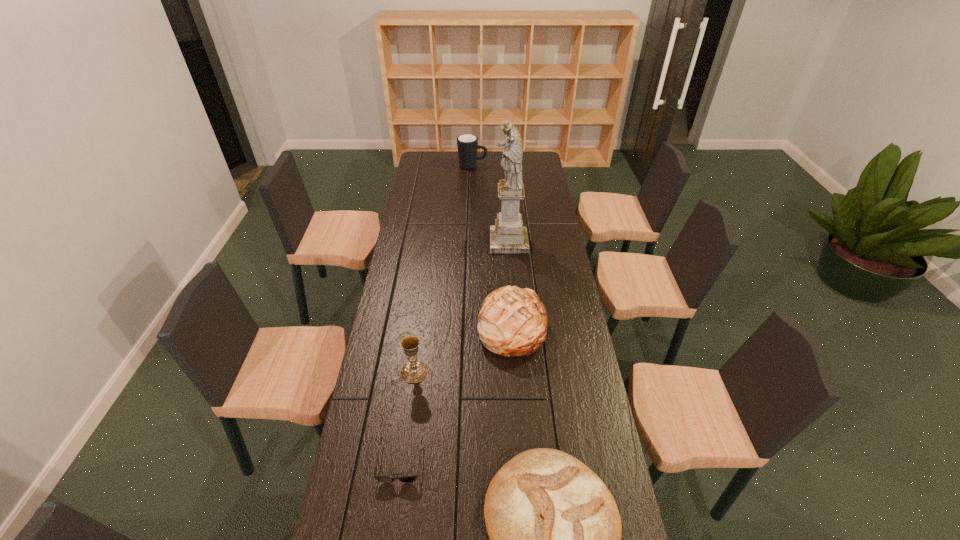
Locate an element on the screen. This screenshot has width=960, height=540. vacant space at the left edge of the desktop is located at coordinates [402, 275].

Image resolution: width=960 pixels, height=540 pixels. In order to click on vacant region at the right edge of the desktop in this screenshot , I will do `click(552, 207)`.

The image size is (960, 540). Find the location of `vacant region at the far left corner of the desktop`. vacant region at the far left corner of the desktop is located at coordinates (437, 161).

At what (x,y) coordinates should I click in order to perform the action: click on vacant area at the far right corner. Please return your answer as a coordinate pair (x, y). The height and width of the screenshot is (540, 960). Looking at the image, I should click on (524, 167).

Where is `vacant space that's between the taller bread and the chalice`? Image resolution: width=960 pixels, height=540 pixels. vacant space that's between the taller bread and the chalice is located at coordinates (463, 350).

Locate an element on the screen. vacant region between the farther bread and the tallest object is located at coordinates (510, 285).

You are a GUI agent. You are given a task and a screenshot of the screen. Output one action in this format:
    pyautogui.click(x=<x>, y=<y>)
    Task: Click on the unoccupied position between the third farthest object and the second farthest object
    
    Given the screenshot: What is the action you would take?
    pyautogui.click(x=510, y=285)

This screenshot has width=960, height=540. Find the location of `vacant space in between the sunglasses and the mug`. vacant space in between the sunglasses and the mug is located at coordinates (437, 314).

Locate an element on the screen. This screenshot has height=540, width=960. the closest object to the farther bread is located at coordinates (413, 371).

Where is `object identified as the second closest to the mug`? This screenshot has width=960, height=540. object identified as the second closest to the mug is located at coordinates click(512, 322).